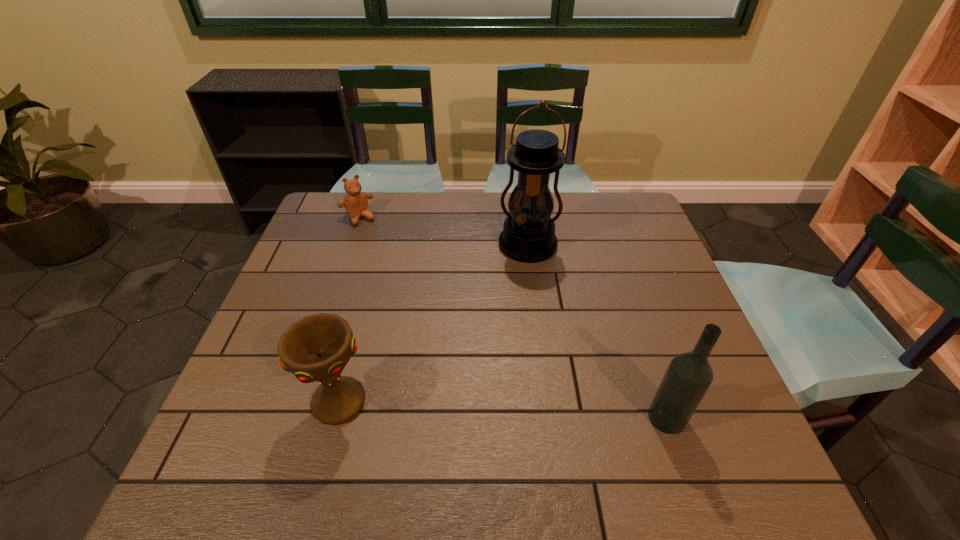
The width and height of the screenshot is (960, 540). Identify the location of free space on the desktop that is between the chalice and the vodka and is positioned above the lantern, indicating its light source. (485, 409).

Where is `free space on the desktop that is between the third tallest object and the vodka and is positioned on the face of the teddy bear`? free space on the desktop that is between the third tallest object and the vodka and is positioned on the face of the teddy bear is located at coordinates (482, 409).